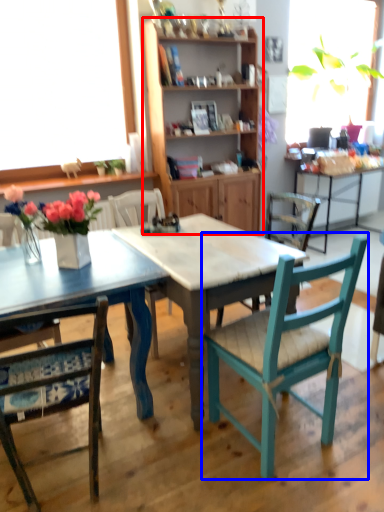
Question: Which object appears closest to the camera in this image, cabinetry (highlighted by a red box) or chair (highlighted by a blue box)?

Choices:
 (A) cabinetry
 (B) chair

Answer: (B)